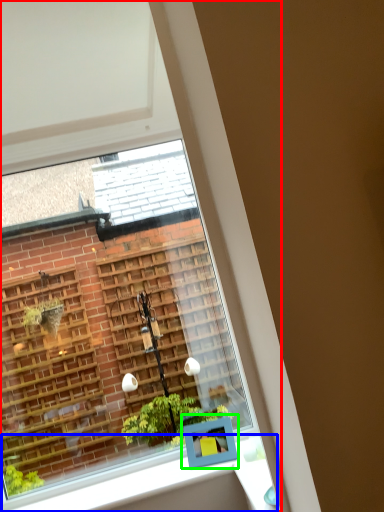
Question: Considering the real-world distances, which object is closest to window (highlighted by a red box)? window sill (highlighted by a blue box) or window box (highlighted by a green box).

Choices:
 (A) window sill
 (B) window box

Answer: (A)